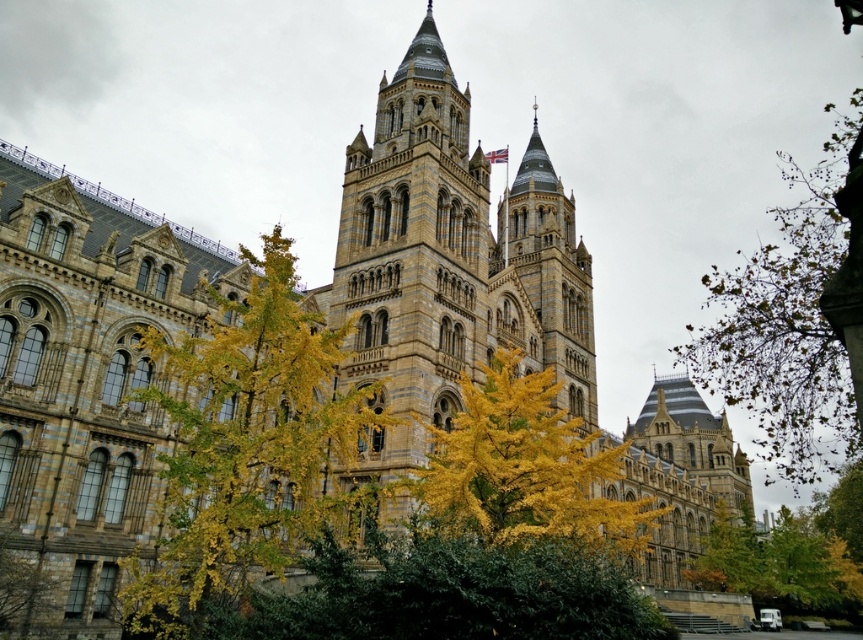
Question: Among these points, which one is farthest from the camera?

Choices:
 (A) (810, 256)
 (B) (364, 504)
 (C) (550, 499)
 (D) (792, 600)

Answer: (D)

Question: Does brown stone tower at center come behind yellow-green leaves at center?

Choices:
 (A) no
 (B) yes

Answer: (B)

Question: Estimate the real-world distances between objects in this image. Which object is closer to the brown stone tower at center?

Choices:
 (A) yellow-green leaves at center
 (B) yellow leafy tree at center

Answer: (B)

Question: Is green leafy tree at upper right further to the viewer compared to yellow leafy tree at center?

Choices:
 (A) yes
 (B) no

Answer: (B)

Question: Where is brown stone tower at center located in relation to yellow leafy tree at center in the image?

Choices:
 (A) left
 (B) right

Answer: (A)

Question: Which is farther from the yellow-green leaves at center?

Choices:
 (A) green leafy tree at upper right
 (B) brown stone tower at center
 (C) yellow leafy tree at lower right

Answer: (C)